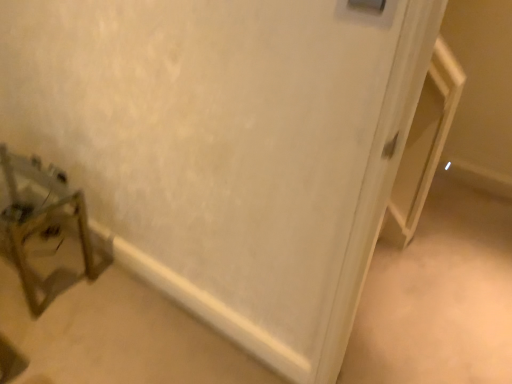
In order to face metallic silver tripod at lower left, should I rotate leftwards or rightwards?

It's best to rotate left around 28.816 degrees.

Locate an element on the screen. The image size is (512, 384). metallic silver tripod at lower left is located at coordinates (42, 225).

What do you see at coordinates (42, 225) in the screenshot? The image size is (512, 384). I see `metallic silver tripod at lower left` at bounding box center [42, 225].

Identify the location of metallic silver tripod at lower left. (42, 225).